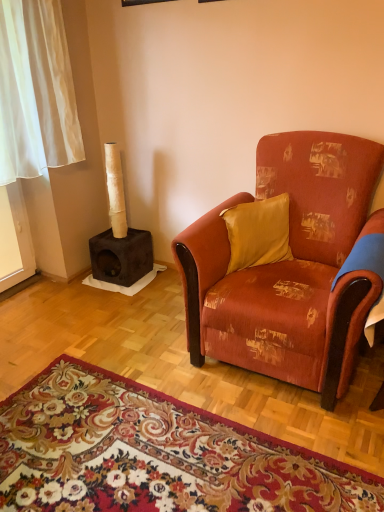
This screenshot has width=384, height=512. In order to click on vacant area on top of floral carpet at lower center (from a real-world perspective) in this screenshot , I will do `click(134, 449)`.